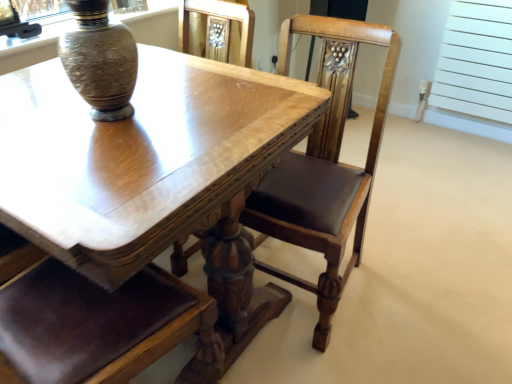
Where is `vacant space to the right of speckled ceramic vase at upper left`? This screenshot has height=384, width=512. vacant space to the right of speckled ceramic vase at upper left is located at coordinates (185, 109).